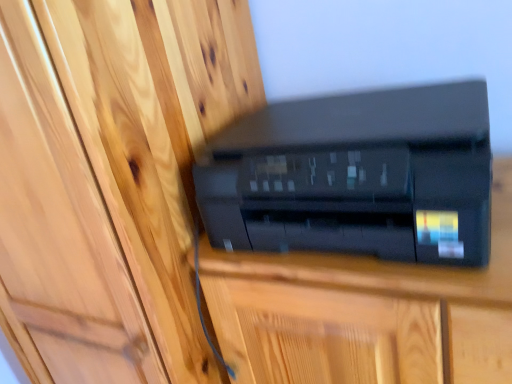
Question: Is black plastic printer at center wider than matte wood door at center?

Choices:
 (A) yes
 (B) no

Answer: (B)

Question: Can you confirm if black plastic printer at center is positioned to the right of matte wood door at center?

Choices:
 (A) yes
 (B) no

Answer: (A)

Question: From the image's perspective, is black plastic printer at center above matte wood door at center?

Choices:
 (A) yes
 (B) no

Answer: (A)

Question: Is black plastic printer at center not within matte wood door at center?

Choices:
 (A) yes
 (B) no

Answer: (A)

Question: Can you confirm if black plastic printer at center is positioned to the left of matte wood door at center?

Choices:
 (A) yes
 (B) no

Answer: (B)

Question: Considering the relative sizes of black plastic printer at center and matte wood door at center in the image provided, is black plastic printer at center thinner than matte wood door at center?

Choices:
 (A) yes
 (B) no

Answer: (A)

Question: Is black plastic printer at center oriented away from matte wood door at center?

Choices:
 (A) yes
 (B) no

Answer: (B)

Question: From a real-world perspective, does black plastic printer at center stand above matte wood door at center?

Choices:
 (A) no
 (B) yes

Answer: (A)

Question: Can you confirm if black plastic printer at center is bigger than matte wood door at center?

Choices:
 (A) no
 (B) yes

Answer: (A)

Question: Are black plastic printer at center and matte wood door at center beside each other?

Choices:
 (A) no
 (B) yes

Answer: (A)

Question: From the image's perspective, is black plastic printer at center on matte wood door at center?

Choices:
 (A) yes
 (B) no

Answer: (B)

Question: Is black plastic printer at center thinner than matte wood door at center?

Choices:
 (A) yes
 (B) no

Answer: (A)

Question: Is matte wood door at center smaller than black plastic printer at center?

Choices:
 (A) no
 (B) yes

Answer: (A)